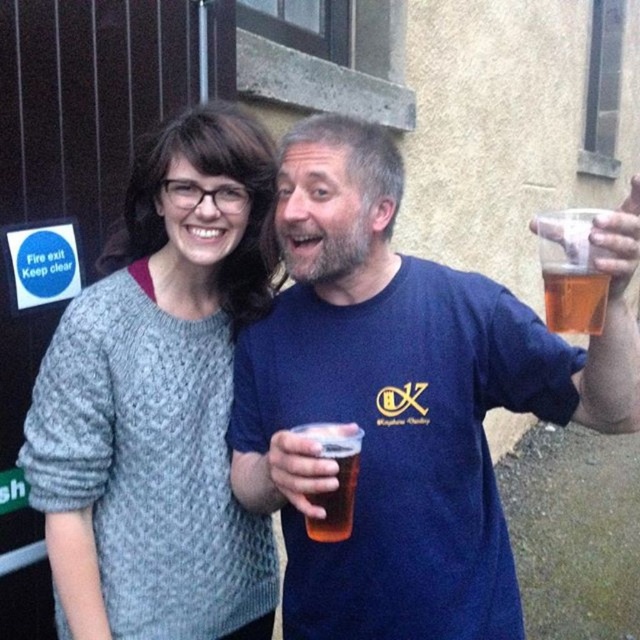
Does blue cotton t-shirt at center appear on the left side of translucent plastic cup at upper right?

Correct, you'll find blue cotton t-shirt at center to the left of translucent plastic cup at upper right.

Is blue cotton t-shirt at center above translucent plastic cup at upper right?

Incorrect, blue cotton t-shirt at center is not positioned above translucent plastic cup at upper right.

What are the coordinates of `blue cotton t-shirt at center` in the screenshot? It's located at (404, 397).

Who is shorter, blue cotton t-shirt at center or translucent plastic cup at center?

With less height is translucent plastic cup at center.

Does point (316, 148) lie behind point (344, 468)?

That is True.

You are a GUI agent. You are given a task and a screenshot of the screen. Output one action in this format:
    pyautogui.click(x=<x>, y=<y>)
    Task: Click on the blue cotton t-shirt at center
    The width and height of the screenshot is (640, 640).
    Given the screenshot: What is the action you would take?
    pyautogui.click(x=404, y=397)

Is translucent plastic cup at upper right further to the viewer compared to translucent plastic cup at center?

No, it is not.

Is translucent plastic cup at upper right to the left of translucent plastic cup at center from the viewer's perspective?

No, translucent plastic cup at upper right is not to the left of translucent plastic cup at center.

At what (x,y) coordinates should I click in order to perform the action: click on translucent plastic cup at upper right. Please return your answer as a coordinate pair (x, y). This screenshot has height=640, width=640. Looking at the image, I should click on pos(573,296).